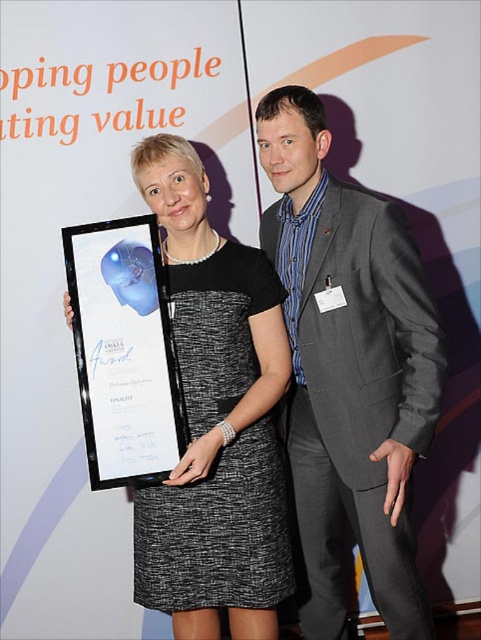
Can you confirm if gray wool suit at center is smaller than black textured dress at center?

Actually, gray wool suit at center might be larger than black textured dress at center.

Does gray wool suit at center have a larger size compared to black textured dress at center?

Yes, gray wool suit at center is bigger than black textured dress at center.

In the scene shown: Who is more distant from viewer, (374, 378) or (144, 566)?

The point (374, 378) is more distant.

Locate an element on the screen. This screenshot has height=640, width=481. gray wool suit at center is located at coordinates (349, 371).

Is gray wool suit at center bigger than white glossy plaque at center?

Yes.

Does gray wool suit at center have a lesser height compared to white glossy plaque at center?

In fact, gray wool suit at center may be taller than white glossy plaque at center.

Who is more forward, (419, 317) or (155, 444)?

Point (155, 444) is in front.

Image resolution: width=481 pixels, height=640 pixels. Find the location of `gray wool suit at center`. gray wool suit at center is located at coordinates (349, 371).

Which is above, black textured dress at center or white glossy plaque at center?

white glossy plaque at center is higher up.

What do you see at coordinates (215, 420) in the screenshot? This screenshot has width=481, height=640. I see `black textured dress at center` at bounding box center [215, 420].

Is point (215, 332) in front of point (96, 378)?

No, it is behind (96, 378).

This screenshot has width=481, height=640. Identify the location of black textured dress at center. (215, 420).